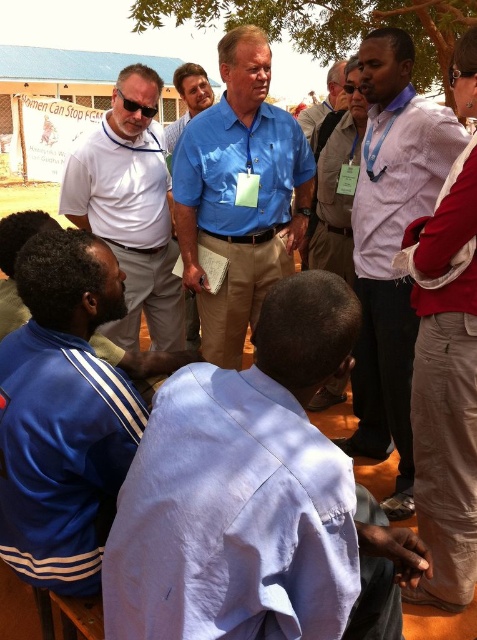
Question: Which object is closer to the camera taking this photo?

Choices:
 (A) white shirt at center
 (B) white shirt at right

Answer: (B)

Question: Does blue fabric jacket at lower left have a smaller size compared to white shirt at center?

Choices:
 (A) no
 (B) yes

Answer: (B)

Question: Is white matte shirt at center above sunglasses at upper center?

Choices:
 (A) no
 (B) yes

Answer: (A)

Question: Among these objects, which one is nearest to the camera?

Choices:
 (A) white matte shirt at center
 (B) white shirt at right
 (C) sunglasses at upper center
 (D) blue cotton shirt at center

Answer: (B)

Question: Does blue cotton shirt at center have a lesser width compared to sunglasses at upper center?

Choices:
 (A) no
 (B) yes

Answer: (A)

Question: Among these objects, which one is farthest from the camera?

Choices:
 (A) white matte shirt at center
 (B) blue cotton shirt at center

Answer: (B)